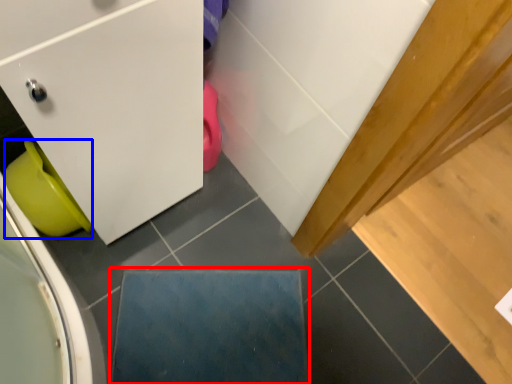
Question: Which object appears farthest to the camera in this image, slate (highlighted by a red box) or toilet bowl (highlighted by a blue box)?

Choices:
 (A) slate
 (B) toilet bowl

Answer: (A)